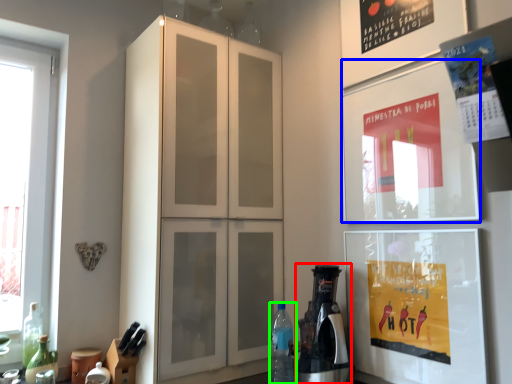
Question: Which is farther away from coffee machine (highlighted by a red box)? poster (highlighted by a blue box) or bottle (highlighted by a green box)?

Choices:
 (A) poster
 (B) bottle

Answer: (A)